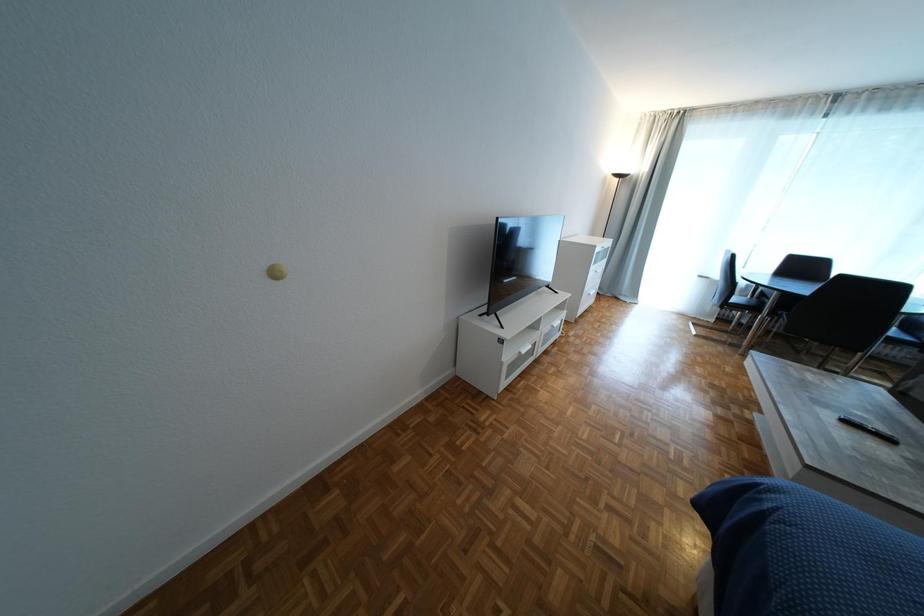
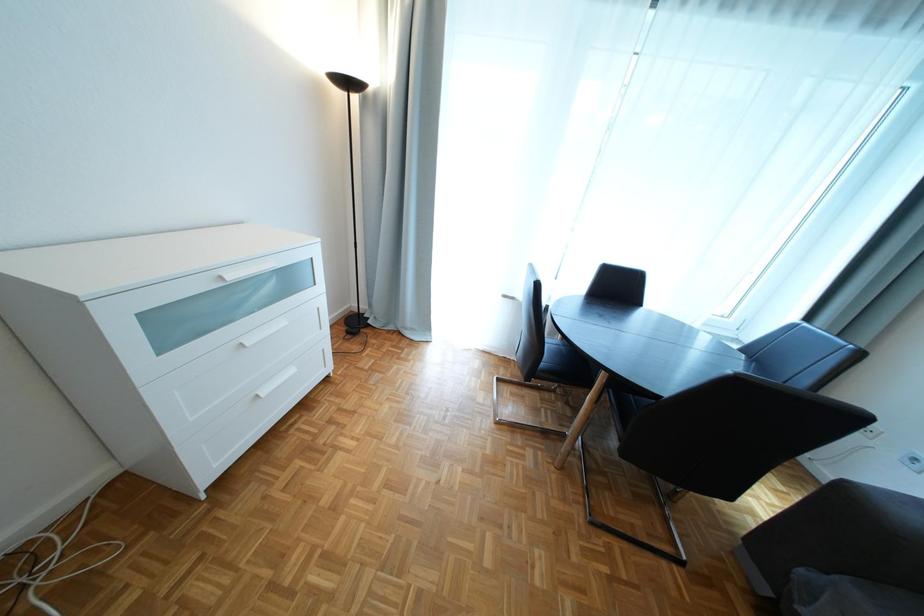
What movement of the cameraman would produce the second image?

The cameraman moved toward right, forward.